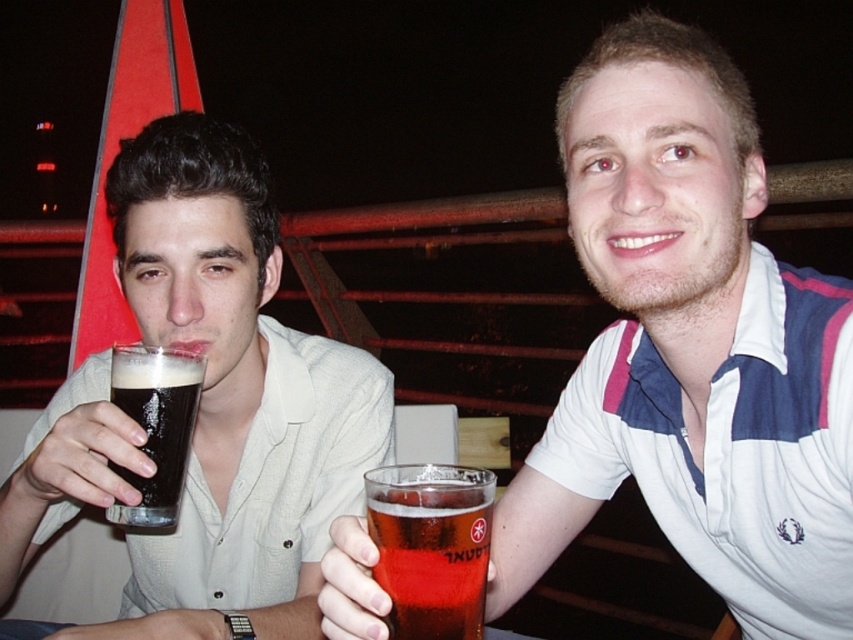
You are standing in front of the two people in the image. Which of the two points, point (196, 241) or point (581, 408), is closer to you?

Point (196, 241) is closer to the viewer than point (581, 408).

What is the exact coordinate of the matte black glass at left in the image?

The matte black glass at left is located at point (234, 396).

You are standing at the center of the image and want to place a new object at the location marked by the point (x=691, y=349). What object is currently occupying that position?

The translucent glass at center is represented by point (x=691, y=349), so the object occupying that position is the translucent glass at center.